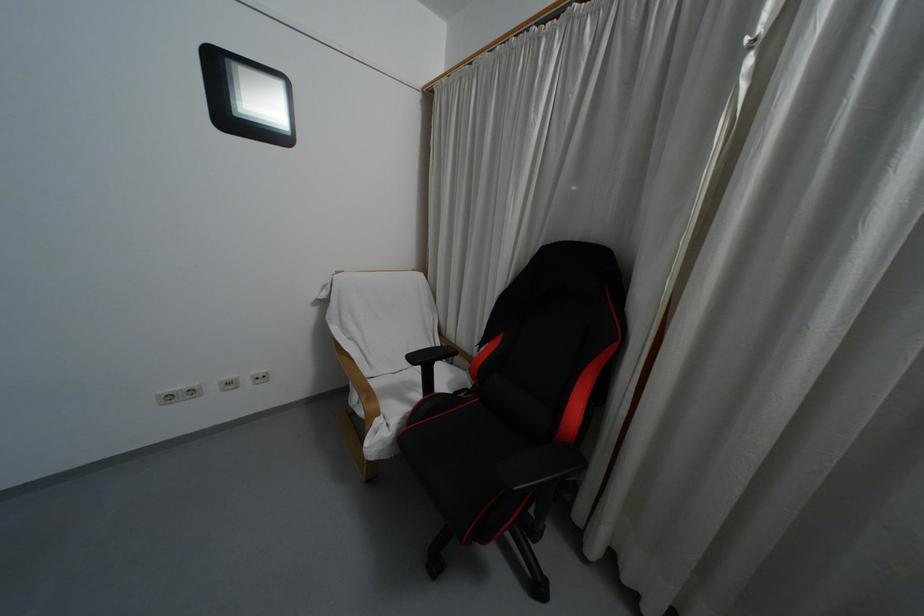
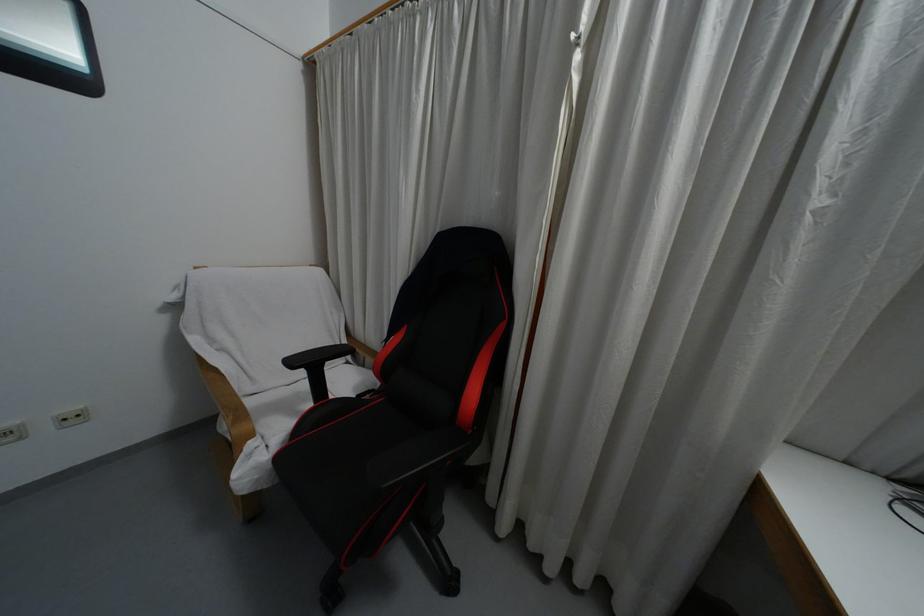
Locate, in the second image, the point that corresponds to [411,358] in the first image.

(292, 362)